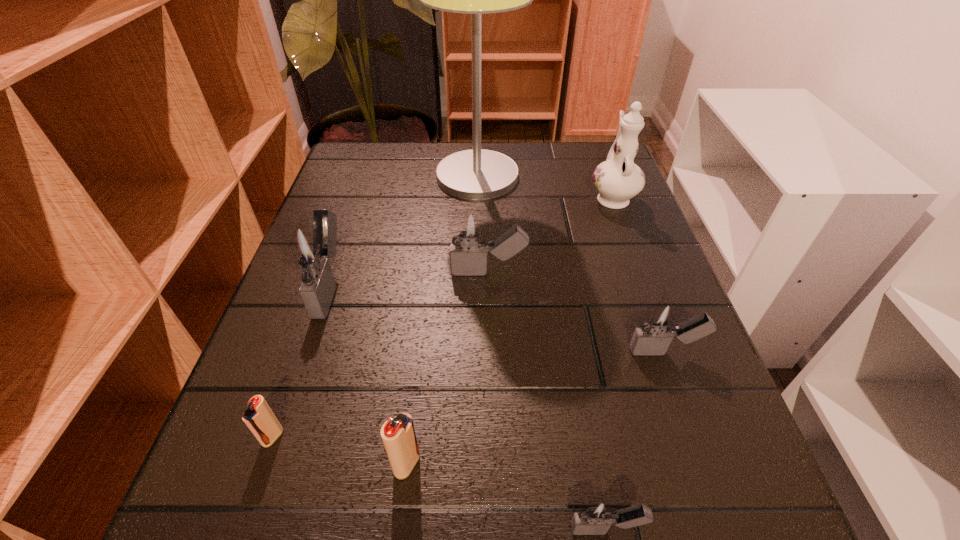
The image size is (960, 540). What are the coordinates of `igniter identified as the closest to the seventh shortest object` in the screenshot? It's located at (469, 230).

At what (x,y) coordinates should I click in order to perform the action: click on the closest gray igniter to the sixth shortest object. Please return your answer as a coordinate pair (x, y). The height and width of the screenshot is (540, 960). Looking at the image, I should click on (469, 230).

The image size is (960, 540). Find the location of `gray igniter that is the nearest to the nearest object`. gray igniter that is the nearest to the nearest object is located at coordinates (659, 324).

This screenshot has width=960, height=540. Find the location of `vacant region that satisfies the following two spatial constraints: 1. on the front side of the biggest gray igniter; 2. on the right side of the rightmost igniter`. vacant region that satisfies the following two spatial constraints: 1. on the front side of the biggest gray igniter; 2. on the right side of the rightmost igniter is located at coordinates (309, 352).